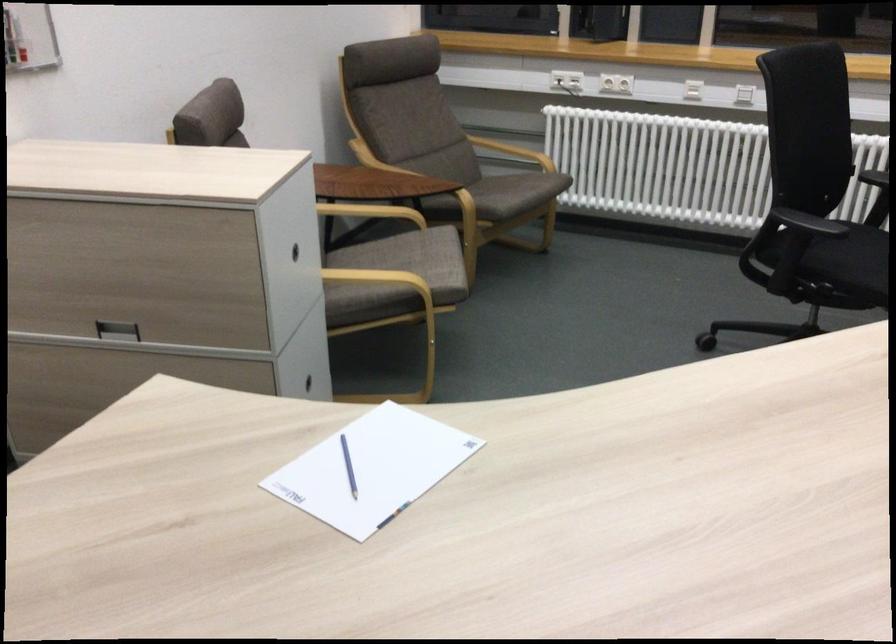
Find where to writ the blue pen. Please return your answer as a coordinate pair (x, y).

(348, 466)